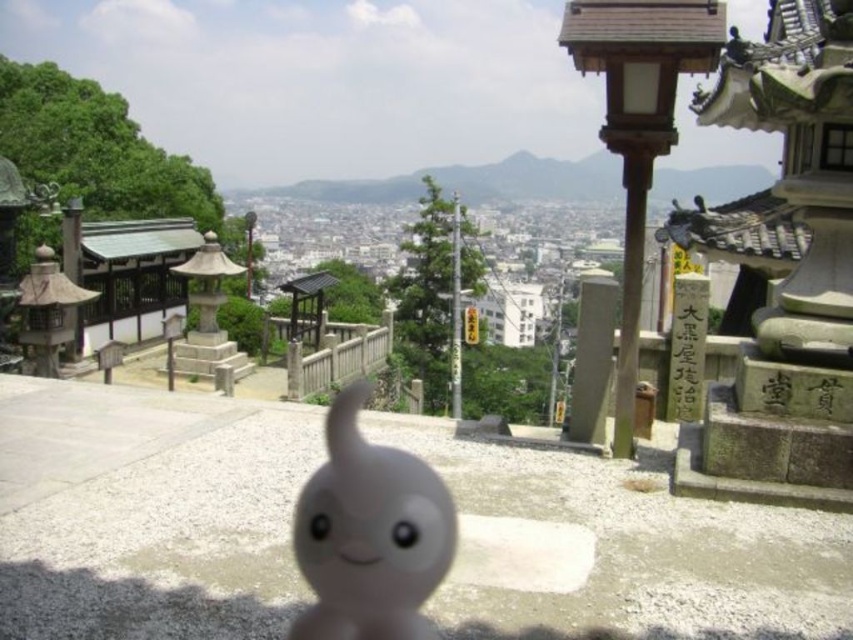
Question: In this image, where is gray stone pillar at center located relative to white stone signpost at right?

Choices:
 (A) below
 (B) above

Answer: (A)

Question: Can you confirm if gray stone pillar at center is positioned to the right of white stone signpost at right?

Choices:
 (A) yes
 (B) no

Answer: (A)

Question: Which object is positioned closest to the white stone signpost at right?

Choices:
 (A) white matte ghost at center
 (B) gray stone pillar at center

Answer: (A)

Question: Estimate the real-world distances between objects in this image. Which object is farther from the gray stone pillar at center?

Choices:
 (A) white stone signpost at right
 (B) white matte ghost at center

Answer: (A)

Question: Among these points, which one is nearest to the camera?

Choices:
 (A) (289, 628)
 (B) (700, 282)

Answer: (A)

Question: In this image, where is gray stone pillar at center located relative to white stone signpost at right?

Choices:
 (A) below
 (B) above

Answer: (A)